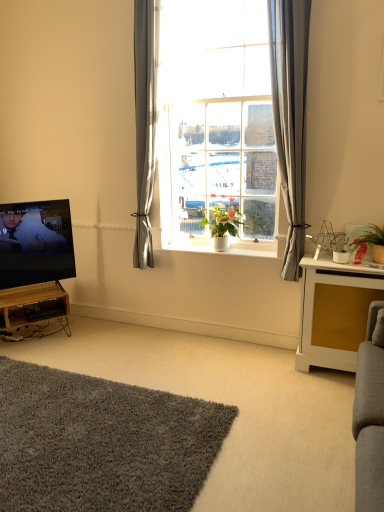
Question: Considering the relative positions of soft gray carpet at lower left and clear glass window at center in the image provided, is soft gray carpet at lower left behind clear glass window at center?

Choices:
 (A) yes
 (B) no

Answer: (B)

Question: Would you say soft gray carpet at lower left contains clear glass window at center?

Choices:
 (A) no
 (B) yes

Answer: (A)

Question: Is soft gray carpet at lower left not close to clear glass window at center?

Choices:
 (A) no
 (B) yes

Answer: (B)

Question: Is soft gray carpet at lower left facing towards clear glass window at center?

Choices:
 (A) yes
 (B) no

Answer: (B)

Question: Can you confirm if soft gray carpet at lower left is taller than clear glass window at center?

Choices:
 (A) yes
 (B) no

Answer: (B)

Question: From the image's perspective, is soft gray carpet at lower left located above or below white textured cabinet at right, positioned as the 1th table in front-to-back order?

Choices:
 (A) below
 (B) above

Answer: (A)

Question: From a real-world perspective, is soft gray carpet at lower left positioned above or below white textured cabinet at right, arranged as the second table when viewed from the left?

Choices:
 (A) above
 (B) below

Answer: (B)

Question: In terms of width, does soft gray carpet at lower left look wider or thinner when compared to white textured cabinet at right, which is the 2th table in back-to-front order?

Choices:
 (A) wide
 (B) thin

Answer: (A)

Question: Choose the correct answer: Is soft gray carpet at lower left inside white textured cabinet at right, which is counted as the first table, starting from the right, or outside it?

Choices:
 (A) inside
 (B) outside

Answer: (B)

Question: Is green matte plant at right, which ranks as the first houseplant in right-to-left order, in front of or behind green matte plant at center, arranged as the 1th houseplant when viewed from the back, in the image?

Choices:
 (A) front
 (B) behind

Answer: (A)

Question: From a real-world perspective, relative to green matte plant at center, arranged as the 1th houseplant when viewed from the back, is green matte plant at right, which appears as the first houseplant when viewed from the front, vertically above or below?

Choices:
 (A) above
 (B) below

Answer: (B)

Question: Choose the correct answer: Is green matte plant at right, which appears as the second houseplant when viewed from the left, inside green matte plant at center, which is the 1th houseplant in left-to-right order, or outside it?

Choices:
 (A) outside
 (B) inside

Answer: (A)

Question: Considering the positions of green matte plant at right, which appears as the first houseplant when viewed from the front, and green matte plant at center, the 2th houseplant from the right, in the image, is green matte plant at right, which appears as the first houseplant when viewed from the front, taller or shorter than green matte plant at center, the 2th houseplant from the right,?

Choices:
 (A) short
 (B) tall

Answer: (A)

Question: Is matte black tv at left spatially inside gray fabric curtain at center, or outside of it?

Choices:
 (A) outside
 (B) inside

Answer: (A)

Question: From the image's perspective, is matte black tv at left above or below gray fabric curtain at center?

Choices:
 (A) below
 (B) above

Answer: (A)